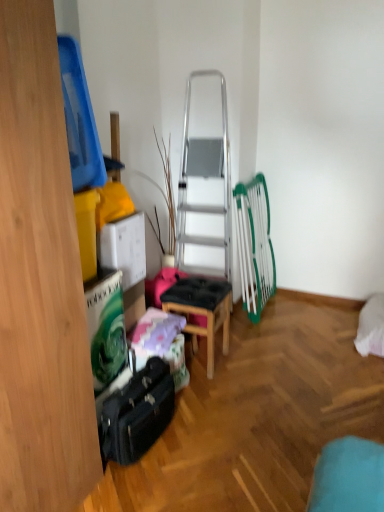
Question: Is wooden stool at center a part of black leather suitcase at lower left?

Choices:
 (A) no
 (B) yes

Answer: (A)

Question: Is black leather suitcase at lower left facing towards wooden stool at center?

Choices:
 (A) yes
 (B) no

Answer: (B)

Question: From a real-world perspective, is black leather suitcase at lower left located higher than wooden stool at center?

Choices:
 (A) no
 (B) yes

Answer: (A)

Question: Is black leather suitcase at lower left at the left side of wooden stool at center?

Choices:
 (A) no
 (B) yes

Answer: (B)

Question: From a real-world perspective, is black leather suitcase at lower left beneath wooden stool at center?

Choices:
 (A) no
 (B) yes

Answer: (B)

Question: Is black leather suitcase at lower left far from wooden stool at center?

Choices:
 (A) no
 (B) yes

Answer: (A)

Question: From a real-world perspective, is wooden stool at center positioned under black leather suitcase at lower left based on gravity?

Choices:
 (A) yes
 (B) no

Answer: (B)

Question: Does wooden stool at center lie behind black leather suitcase at lower left?

Choices:
 (A) yes
 (B) no

Answer: (A)

Question: Is the depth of wooden stool at center less than that of black leather suitcase at lower left?

Choices:
 (A) yes
 (B) no

Answer: (B)

Question: From the image's perspective, is wooden stool at center beneath black leather suitcase at lower left?

Choices:
 (A) no
 (B) yes

Answer: (A)

Question: Is black leather suitcase at lower left surrounded by wooden stool at center?

Choices:
 (A) no
 (B) yes

Answer: (A)

Question: Is wooden stool at center smaller than black leather suitcase at lower left?

Choices:
 (A) yes
 (B) no

Answer: (B)

Question: Would you say wooden stool at center is to the left or to the right of black leather suitcase at lower left in the picture?

Choices:
 (A) left
 (B) right

Answer: (B)